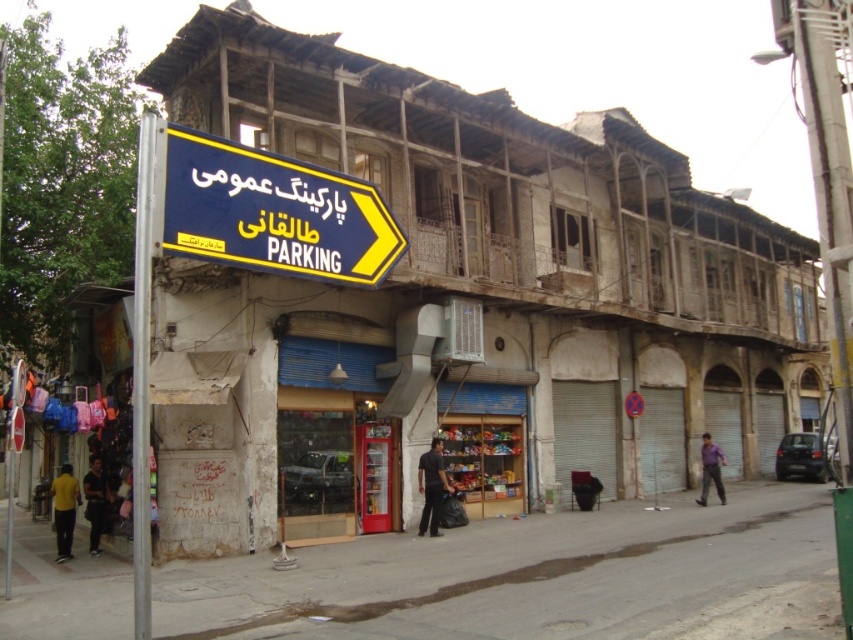
Question: Is blue painted metal signboard at upper left behind blue plastic sign at upper left?

Choices:
 (A) no
 (B) yes

Answer: (B)

Question: Which point appears farthest from the camera in this image?

Choices:
 (A) (316, 172)
 (B) (811, 296)

Answer: (B)

Question: Does blue painted metal signboard at upper left come behind blue plastic sign at upper left?

Choices:
 (A) yes
 (B) no

Answer: (A)

Question: Considering the relative positions of blue painted metal signboard at upper left and blue plastic sign at upper left in the image provided, where is blue painted metal signboard at upper left located with respect to blue plastic sign at upper left?

Choices:
 (A) above
 (B) below

Answer: (B)

Question: Among these points, which one is farthest from the camera?

Choices:
 (A) (236, 172)
 (B) (209, 449)

Answer: (B)